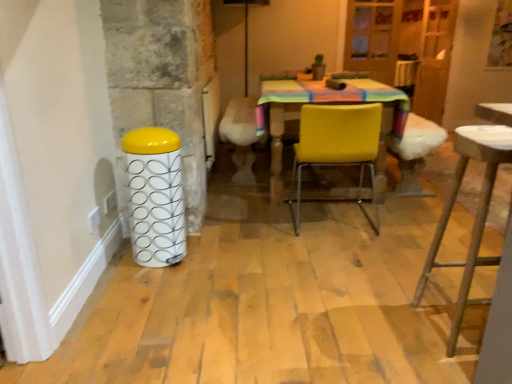
Find the location of a particular element. unoccupied space behind yellow matte chair at center is located at coordinates (316, 193).